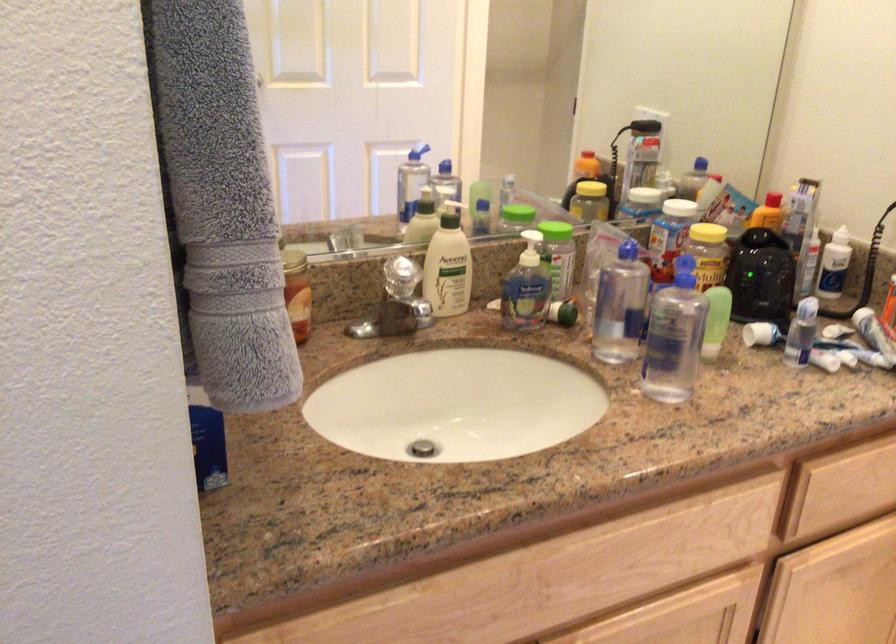
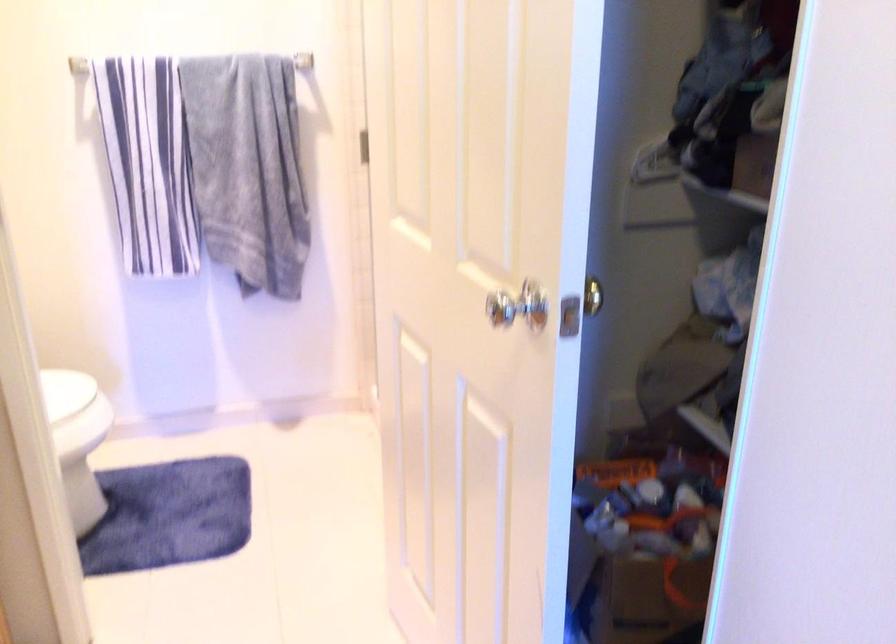
How did the camera likely rotate?

The camera's rotation is toward right-down.